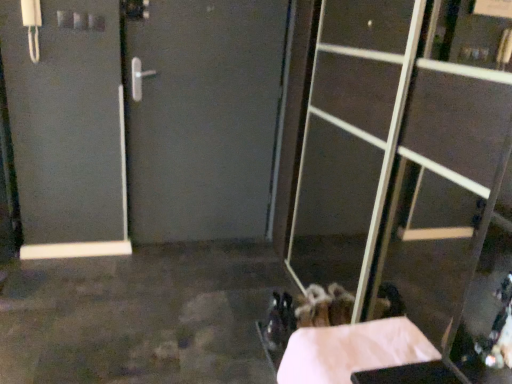
Question: Considering the positions of point (295, 352) and point (320, 61), is point (295, 352) closer or farther from the camera than point (320, 61)?

Choices:
 (A) farther
 (B) closer

Answer: (B)

Question: Is white paper at lower right spatially inside transparent glass door at right, or outside of it?

Choices:
 (A) outside
 (B) inside

Answer: (A)

Question: In terms of height, does white paper at lower right look taller or shorter compared to transparent glass door at right?

Choices:
 (A) tall
 (B) short

Answer: (B)

Question: Is transparent glass door at right in front of or behind white paper at lower right in the image?

Choices:
 (A) behind
 (B) front

Answer: (B)

Question: Considering the positions of transparent glass door at right and white paper at lower right in the image, is transparent glass door at right taller or shorter than white paper at lower right?

Choices:
 (A) tall
 (B) short

Answer: (A)

Question: From a real-world perspective, is transparent glass door at right physically located above or below white paper at lower right?

Choices:
 (A) below
 (B) above

Answer: (B)

Question: Looking at the image, does transparent glass door at right seem bigger or smaller compared to white paper at lower right?

Choices:
 (A) small
 (B) big

Answer: (B)